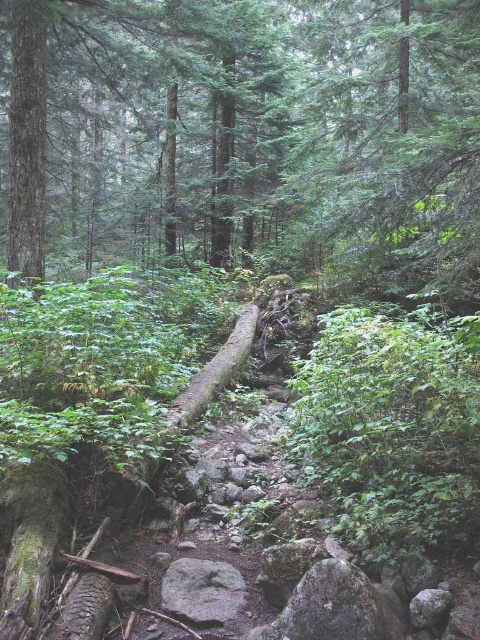
Who is lower down, green leafy tree at center or smooth brown log at left?

smooth brown log at left

Does point (420, 253) come in front of point (17, 124)?

No, (420, 253) is further to viewer.

At what (x,y) coordinates should I click in order to perform the action: click on green leafy tree at center. Please return your answer as a coordinate pair (x, y). This screenshot has height=640, width=480. Looking at the image, I should click on (253, 131).

Which is more to the left, green leafy tree at center or gray rough rock at center?

green leafy tree at center is more to the left.

The height and width of the screenshot is (640, 480). What are the coordinates of `green leafy tree at center` in the screenshot? It's located at (253, 131).

I want to click on green leafy tree at center, so click(x=253, y=131).

Is smooth brown log at left taller than gray rough rock at center?

Indeed, smooth brown log at left has a greater height compared to gray rough rock at center.

Is smooth brown log at left to the right of gray rough rock at center from the viewer's perspective?

In fact, smooth brown log at left is to the left of gray rough rock at center.

I want to click on smooth brown log at left, so click(26, 138).